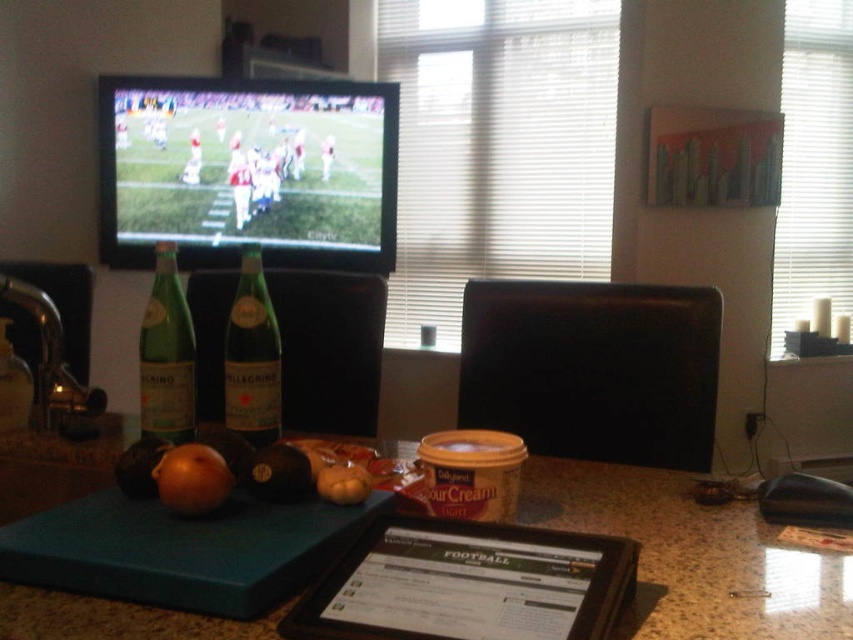
Who is higher up, black plastic tablet at center or green glass bottle at left?

green glass bottle at left is above.

Can you confirm if black plastic tablet at center is smaller than green glass bottle at left?

Yes, black plastic tablet at center is smaller than green glass bottle at left.

Does point (419, 589) lie in front of point (143, 314)?

Yes, point (419, 589) is closer to viewer.

Locate an element on the screen. The height and width of the screenshot is (640, 853). black plastic tablet at center is located at coordinates (467, 582).

Who is shorter, smooth green grass at center or orange matte onion at lower left?

orange matte onion at lower left is shorter.

Does smooth green grass at center have a greater width compared to orange matte onion at lower left?

Correct, the width of smooth green grass at center exceeds that of orange matte onion at lower left.

Who is more forward, (268, 193) or (157, 492)?

Point (157, 492) is in front.

Identify the location of smooth green grass at center. (252, 163).

Can you confirm if smooth green grass at center is wider than black matte onion at center?

Yes, smooth green grass at center is wider than black matte onion at center.

Can you confirm if smooth green grass at center is smaller than black matte onion at center?

Actually, smooth green grass at center might be larger than black matte onion at center.

Image resolution: width=853 pixels, height=640 pixels. What do you see at coordinates (252, 163) in the screenshot?
I see `smooth green grass at center` at bounding box center [252, 163].

Where is `smooth green grass at center`? The height and width of the screenshot is (640, 853). smooth green grass at center is located at coordinates (252, 163).